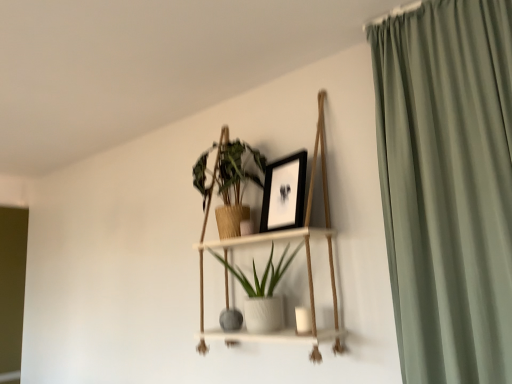
Question: Based on their positions, is matte gray vase at center located to the left or right of black matte picture frame at upper center?

Choices:
 (A) left
 (B) right

Answer: (A)

Question: Looking at their shapes, would you say matte gray vase at center is wider or thinner than black matte picture frame at upper center?

Choices:
 (A) thin
 (B) wide

Answer: (B)

Question: Estimate the real-world distances between objects in this image. Which object is closer to the white wood shelf at center?

Choices:
 (A) white textured pot at center, acting as the second houseplant starting from the top
 (B) green matte plant at upper center, which appears as the 1th houseplant when viewed from the top
 (C) matte gray vase at center
 (D) black matte picture frame at upper center

Answer: (A)

Question: Which is farther from the green matte plant at upper center, which appears as the 1th houseplant when viewed from the top?

Choices:
 (A) black matte picture frame at upper center
 (B) white wood shelf at center
 (C) white textured pot at center, acting as the second houseplant starting from the top
 (D) matte gray vase at center

Answer: (D)